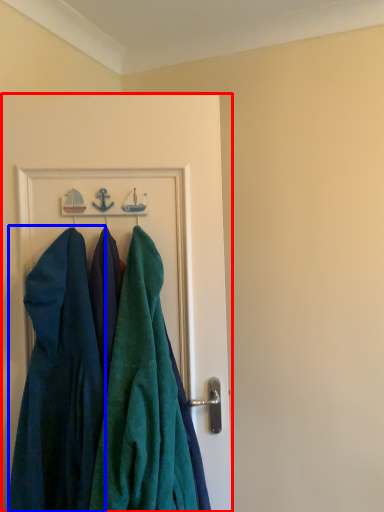
Question: Which object is further to the camera taking this photo, door (highlighted by a red box) or dress (highlighted by a blue box)?

Choices:
 (A) door
 (B) dress

Answer: (A)